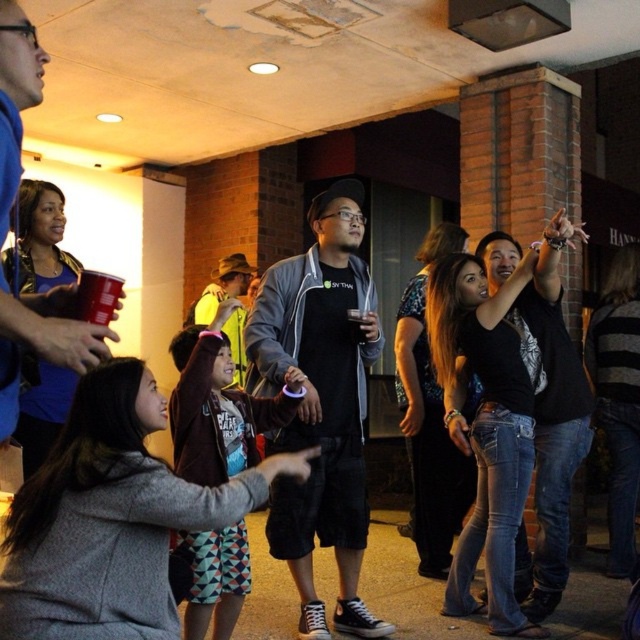
You are taking a photo of the social gathering and want to focus on both point [204,403] and point [244,360]. Which point is closer to your camera lens?

Point [204,403] is closer to the camera lens than point [244,360].

You are at a party and want to find the person wearing the multicolored fabric dress at center and the yellow fabric shirt at center. Which clothing item is larger in size?

The multicolored fabric dress at center is bigger than the yellow fabric shirt at center.